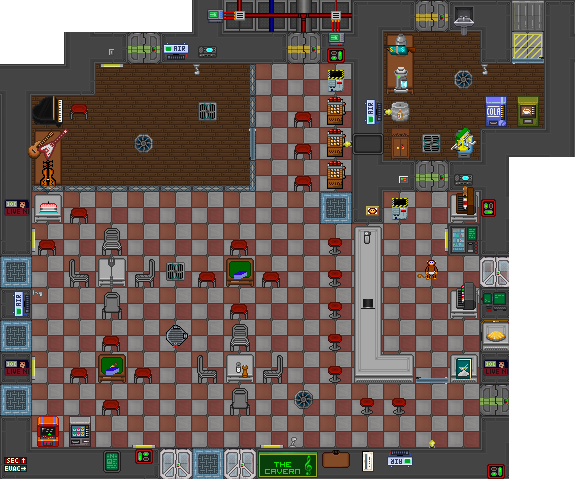
Identify the location of electronic doors. The width and height of the screenshot is (575, 479). (438, 24), (310, 41), (432, 170), (494, 274), (494, 395), (246, 471), (161, 462).